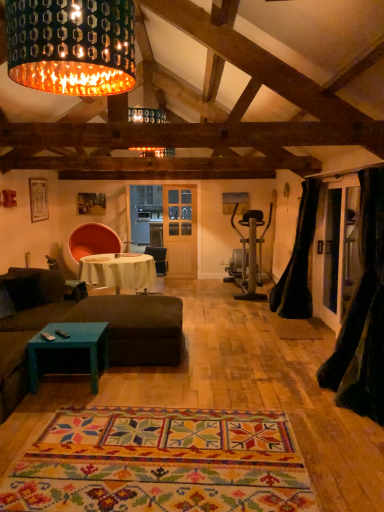
Question: Could you tell me if metallic perforated shade at upper center is facing white cloth-covered table at center?

Choices:
 (A) no
 (B) yes

Answer: (A)

Question: Considering the relative sizes of metallic perforated shade at upper center and white cloth-covered table at center in the image provided, is metallic perforated shade at upper center shorter than white cloth-covered table at center?

Choices:
 (A) no
 (B) yes

Answer: (B)

Question: Is metallic perforated shade at upper center beside white cloth-covered table at center?

Choices:
 (A) no
 (B) yes

Answer: (A)

Question: Is metallic perforated shade at upper center behind white cloth-covered table at center?

Choices:
 (A) yes
 (B) no

Answer: (B)

Question: Would you consider metallic perforated shade at upper center to be distant from white cloth-covered table at center?

Choices:
 (A) yes
 (B) no

Answer: (A)

Question: Considering the relative sizes of metallic perforated shade at upper center and white cloth-covered table at center in the image provided, is metallic perforated shade at upper center thinner than white cloth-covered table at center?

Choices:
 (A) no
 (B) yes

Answer: (B)

Question: Is black velvet curtain at right, arranged as the 2th curtain when viewed from the back, beside multicolored woven rug at center?

Choices:
 (A) yes
 (B) no

Answer: (B)

Question: Is black velvet curtain at right, arranged as the 2th curtain when viewed from the back, aimed at multicolored woven rug at center?

Choices:
 (A) no
 (B) yes

Answer: (A)

Question: Considering the relative positions of black velvet curtain at right, arranged as the 2th curtain when viewed from the back, and multicolored woven rug at center in the image provided, is black velvet curtain at right, arranged as the 2th curtain when viewed from the back, to the left of multicolored woven rug at center from the viewer's perspective?

Choices:
 (A) no
 (B) yes

Answer: (A)

Question: Can you confirm if black velvet curtain at right, arranged as the 1th curtain when viewed from the front, is thinner than multicolored woven rug at center?

Choices:
 (A) no
 (B) yes

Answer: (B)

Question: From a real-world perspective, does black velvet curtain at right, arranged as the 2th curtain when viewed from the back, stand above multicolored woven rug at center?

Choices:
 (A) no
 (B) yes

Answer: (B)

Question: Are black velvet curtain at right, arranged as the 2th curtain when viewed from the back, and multicolored woven rug at center located far from each other?

Choices:
 (A) yes
 (B) no

Answer: (A)

Question: Could you tell me if dark brown fabric couch at center is turned towards brown fabric couch at lower left?

Choices:
 (A) no
 (B) yes

Answer: (B)